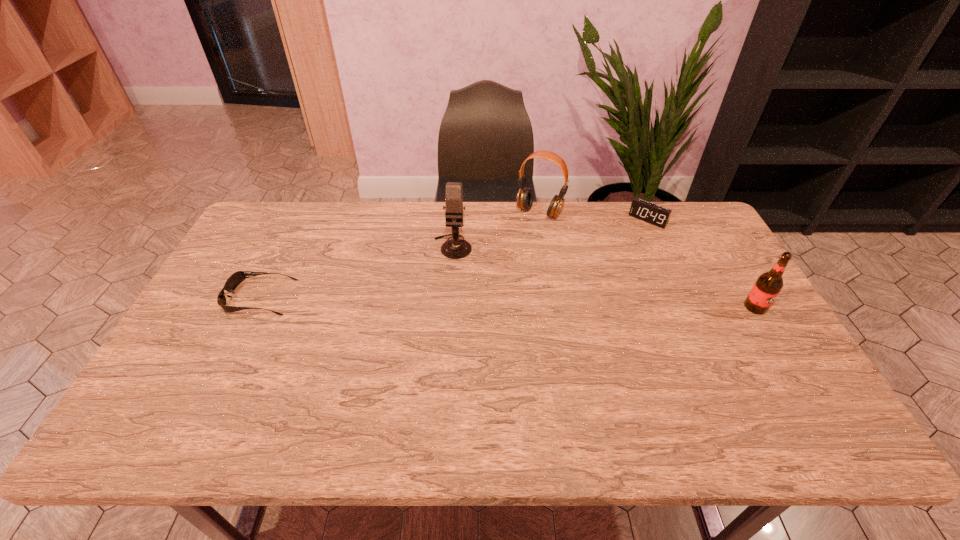
This screenshot has width=960, height=540. I want to click on free point located 0.130m on the left of the root beer, so click(699, 307).

Find the location of a particular element. free space located 0.050m on the front-facing side of the fourth object from right to left is located at coordinates (450, 270).

Where is `blank space located 0.380m on the front-facing side of the fourth object from right to left`? The image size is (960, 540). blank space located 0.380m on the front-facing side of the fourth object from right to left is located at coordinates (439, 358).

Find the location of `vacant point located 0.370m on the front-facing side of the fourth object from right to left`. vacant point located 0.370m on the front-facing side of the fourth object from right to left is located at coordinates (440, 355).

Where is `vacant space situated on the front-facing side of the second object from right to left`? The width and height of the screenshot is (960, 540). vacant space situated on the front-facing side of the second object from right to left is located at coordinates (627, 244).

You are a GUI agent. You are given a task and a screenshot of the screen. Output one action in this format:
    pyautogui.click(x=<x>, y=<y>)
    Task: Click on the free space located on the front-facing side of the second object from right to left
    This screenshot has width=960, height=540.
    Given the screenshot: What is the action you would take?
    pyautogui.click(x=617, y=254)

The width and height of the screenshot is (960, 540). Identify the location of free space located on the front-facing side of the second object from right to left. (613, 259).

I want to click on free spot located 0.060m on the ear cups of the headset, so click(524, 232).

You are a GUI agent. You are given a task and a screenshot of the screen. Output one action in this format:
    pyautogui.click(x=<x>, y=<y>)
    Task: Click on the vacant region located 0.080m on the ear cups of the headset
    
    Given the screenshot: What is the action you would take?
    pyautogui.click(x=522, y=235)

At what (x,y) coordinates should I click in order to perform the action: click on free space located on the ear cups of the headset. Please return your answer as a coordinate pair (x, y). This screenshot has height=540, width=960. Looking at the image, I should click on (482, 297).